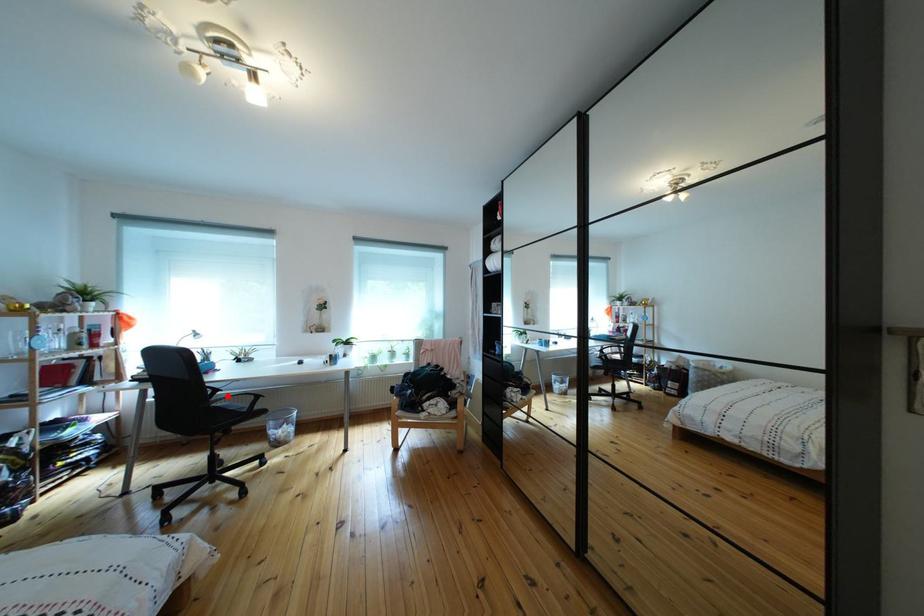
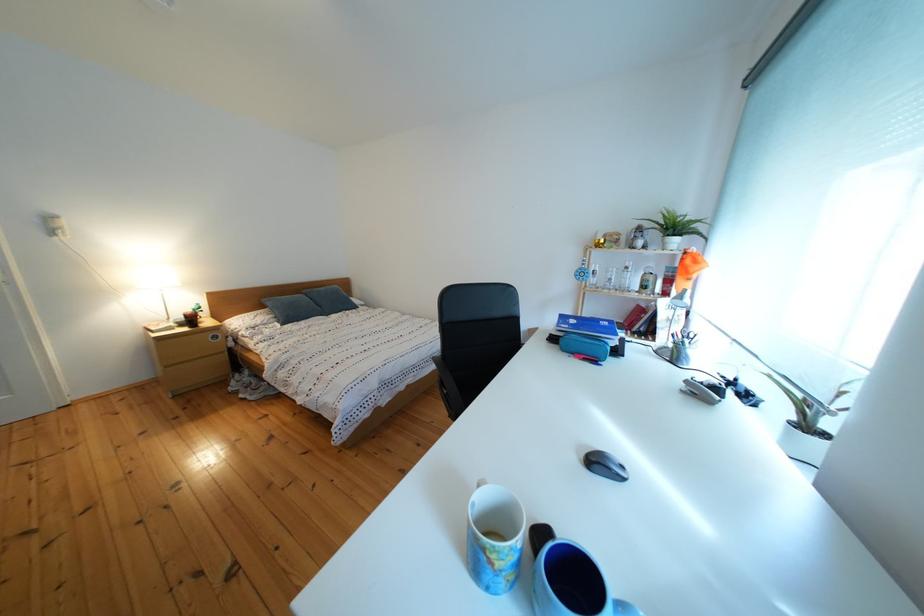
Question: I am providing you with two images of the same scene from different viewpoints. A red point is marked on the first image. Can you still see the location of the red point in image 2?

Choices:
 (A) Yes
 (B) No

Answer: (B)